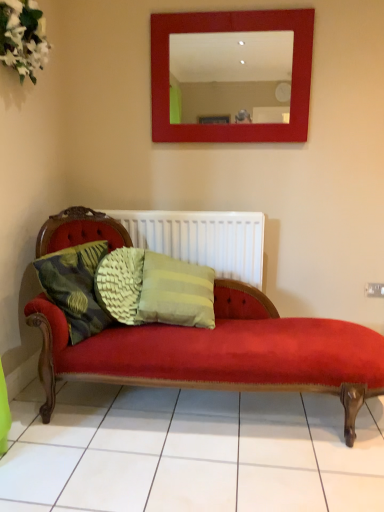
Image resolution: width=384 pixels, height=512 pixels. Describe the element at coordinates (202, 239) in the screenshot. I see `white textured radiator at center` at that location.

Image resolution: width=384 pixels, height=512 pixels. What are the coordinates of `green textured cushion at left` in the screenshot? It's located at [x=75, y=287].

Measure the distance between green textured cushion at left and camera.

They are 1.86 meters apart.

In order to click on white fabric flowers at upper left in this screenshot , I will do `click(23, 37)`.

The width and height of the screenshot is (384, 512). What do you see at coordinates (23, 37) in the screenshot?
I see `white fabric flowers at upper left` at bounding box center [23, 37].

What are the coordinates of `white textured radiator at center` in the screenshot? It's located at (202, 239).

Is green textured cushion at left at the back of white fabric flowers at upper left?

No, white fabric flowers at upper left is not facing away from green textured cushion at left.

Considering the sizes of white fabric flowers at upper left and green textured cushion at left in the image, is white fabric flowers at upper left taller or shorter than green textured cushion at left?

white fabric flowers at upper left is taller than green textured cushion at left.

Considering their positions, is white fabric flowers at upper left located in front of or behind green textured cushion at left?

In the image, white fabric flowers at upper left appears in front of green textured cushion at left.

From the picture: How different are the orientations of white fabric flowers at upper left and green textured cushion at left in degrees?

19.4 degrees.

From a real-world perspective, between white textured radiator at center and green textured cushion at left, who is vertically lower?

From a 3D spatial view, green textured cushion at left is below.

Does white textured radiator at center have a lesser height compared to green textured cushion at left?

In fact, white textured radiator at center may be taller than green textured cushion at left.

Is white textured radiator at center oriented towards green textured cushion at left?

Yes, white textured radiator at center is facing green textured cushion at left.

Which of these two, white textured radiator at center or green textured cushion at left, is smaller?

Smaller between the two is green textured cushion at left.

Is white fabric flowers at upper left bigger or smaller than white textured radiator at center?

white fabric flowers at upper left is smaller than white textured radiator at center.

Considering the positions of objects white fabric flowers at upper left and white textured radiator at center in the image provided, who is behind, white fabric flowers at upper left or white textured radiator at center?

white textured radiator at center.

You are a GUI agent. You are given a task and a screenshot of the screen. Output one action in this format:
    pyautogui.click(x=<x>, y=<y>)
    Task: Click on the radiator located behind the white fabric flowers at upper left
    This screenshot has height=512, width=384.
    Given the screenshot: What is the action you would take?
    pyautogui.click(x=202, y=239)

Is white fabric flowers at upper left in contact with white textured radiator at center?

white fabric flowers at upper left and white textured radiator at center are not in contact.

Identify the location of pillow on the left of white textured radiator at center. (75, 287).

Considering the sizes of objects green textured cushion at left and white textured radiator at center in the image provided, who is thinner, green textured cushion at left or white textured radiator at center?

With smaller width is white textured radiator at center.

From the image's perspective, does green textured cushion at left appear higher than white textured radiator at center?

No.

Would you say green textured cushion at left is a long distance from white textured radiator at center?

No, green textured cushion at left is not far from white textured radiator at center.

Is white textured radiator at center bigger or smaller than white fabric flowers at upper left?

Clearly, white textured radiator at center is larger in size than white fabric flowers at upper left.

Which of these two, white textured radiator at center or white fabric flowers at upper left, is wider?

white fabric flowers at upper left.

From the image's perspective, between white textured radiator at center and white fabric flowers at upper left, which one is located above?

From the image's view, white fabric flowers at upper left is above.

Which of these two, green textured cushion at left or white fabric flowers at upper left, stands taller?

Standing taller between the two is white fabric flowers at upper left.

Can you tell me how much green textured cushion at left and white fabric flowers at upper left differ in facing direction?

19.4 degrees separate the facing orientations of green textured cushion at left and white fabric flowers at upper left.

Can you confirm if green textured cushion at left is positioned to the left of white fabric flowers at upper left?

Incorrect, green textured cushion at left is not on the left side of white fabric flowers at upper left.

Find the location of a particular element. pillow that is below the white fabric flowers at upper left (from the image's perspective) is located at coordinates (75, 287).

Locate an element on the screen. radiator located above the green textured cushion at left (from the image's perspective) is located at coordinates (202, 239).

Looking at the image, which one is located closer to white fabric flowers at upper left, green textured cushion at left or white textured radiator at center?

green textured cushion at left.

Considering their positions, is white fabric flowers at upper left positioned further to green textured cushion at left than white textured radiator at center?

Among the two, white fabric flowers at upper left is located further to green textured cushion at left.

Estimate the real-world distances between objects in this image. Which object is closer to green textured cushion at left, white textured radiator at center or white fabric flowers at upper left?

white textured radiator at center.

Considering their positions, is white fabric flowers at upper left positioned closer to white textured radiator at center than green textured cushion at left?

Based on the image, green textured cushion at left appears to be nearer to white textured radiator at center.

Which object lies nearer to the anchor point white fabric flowers at upper left, white textured radiator at center or green textured cushion at left?

Among the two, green textured cushion at left is located nearer to white fabric flowers at upper left.

When comparing their distances from white textured radiator at center, does green textured cushion at left or white fabric flowers at upper left seem further?

white fabric flowers at upper left.

Locate an element on the screen. radiator between white fabric flowers at upper left and green textured cushion at left in the up-down direction is located at coordinates (202, 239).